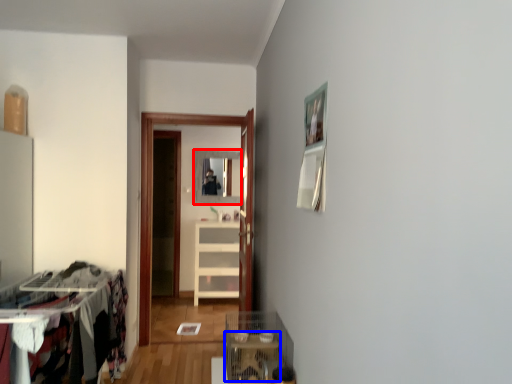
Question: Which object is further to the camera taking this photo, mirror (highlighted by a red box) or table (highlighted by a blue box)?

Choices:
 (A) mirror
 (B) table

Answer: (A)